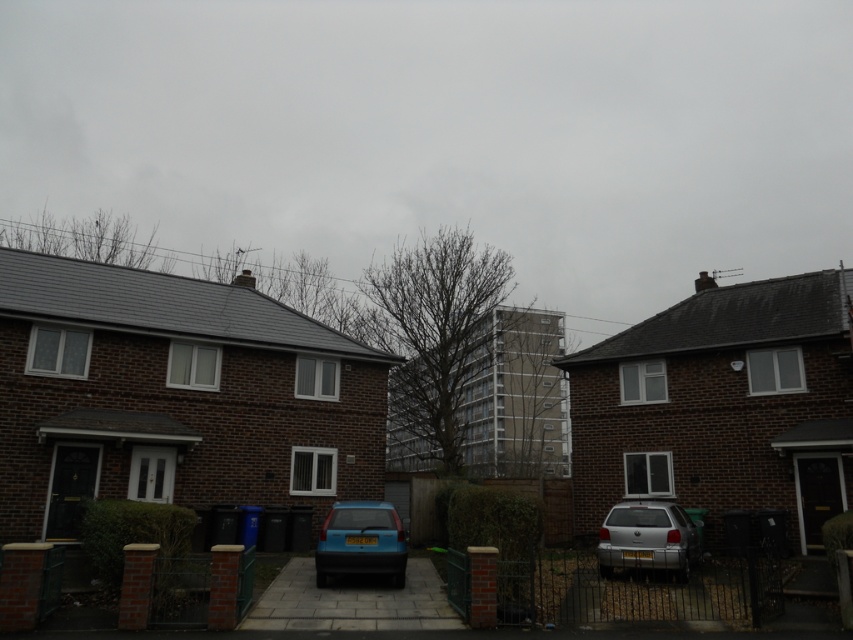
Does silver metallic suv at lower right have a greater width compared to matte blue hatchback at center?

Indeed, silver metallic suv at lower right has a greater width compared to matte blue hatchback at center.

Who is more distant from viewer, (659,552) or (357,566)?

Positioned behind is point (659,552).

The width and height of the screenshot is (853, 640). In order to click on silver metallic suv at lower right in this screenshot , I will do `click(647, 538)`.